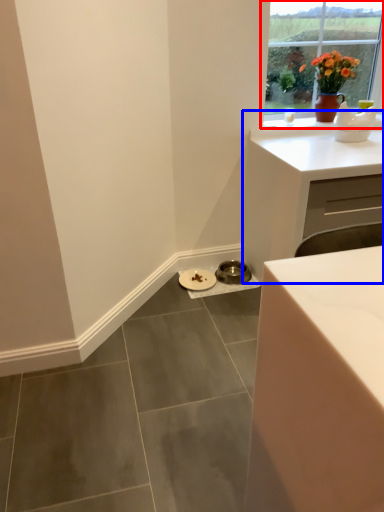
Question: Which of the following is the farthest to the observer, window (highlighted by a red box) or cabinetry (highlighted by a blue box)?

Choices:
 (A) window
 (B) cabinetry

Answer: (A)